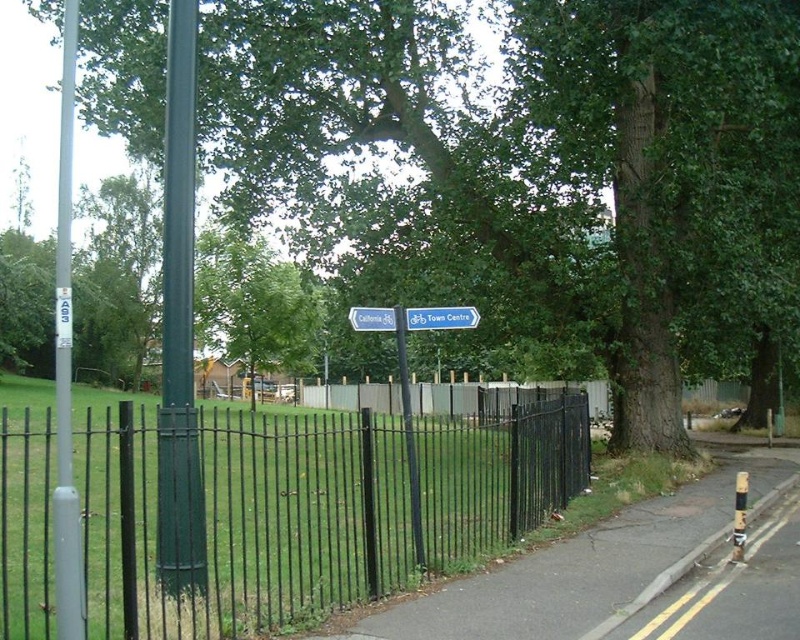
Question: Which point is closer to the camera taking this photo?

Choices:
 (A) (416, 516)
 (B) (468, 312)

Answer: (A)

Question: Can you confirm if black asphalt pavement at lower right is positioned above blue plastic sign at center?

Choices:
 (A) yes
 (B) no

Answer: (B)

Question: Observing the image, what is the correct spatial positioning of green matte pole at left in reference to metallic gray pole at left?

Choices:
 (A) left
 (B) right

Answer: (B)

Question: Does green matte pole at left appear under metallic gray pole at left?

Choices:
 (A) yes
 (B) no

Answer: (A)

Question: Which point is farther to the camera?

Choices:
 (A) green plastic sign at center
 (B) black asphalt pavement at lower right

Answer: (A)

Question: Which point is farther to the camera?

Choices:
 (A) black asphalt pavement at lower right
 (B) green leafy tree at center

Answer: (B)